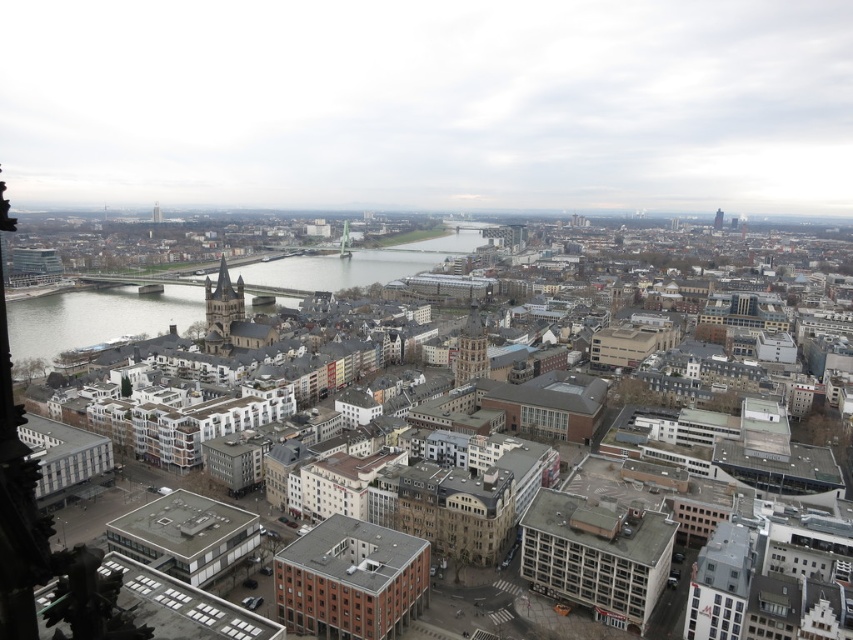
Question: Considering the real-world distances, which object is farthest from the clear glass water at center?

Choices:
 (A) light brown stone tower at center
 (B) brown stone tower at center-left

Answer: (A)

Question: Which of the following is the farthest from the observer?

Choices:
 (A) (161, 214)
 (B) (235, 317)
 (C) (465, 378)

Answer: (A)

Question: In this image, where is clear glass water at center located relative to brown stone tower at center-left?

Choices:
 (A) below
 (B) above

Answer: (B)

Question: Which object appears closest to the camera in this image?

Choices:
 (A) red brick tower at upper right
 (B) smooth gray tower at upper left

Answer: (A)

Question: Is light brown stone tower at center to the right of smooth gray tower at upper left from the viewer's perspective?

Choices:
 (A) yes
 (B) no

Answer: (A)

Question: Observing the image, what is the correct spatial positioning of brown stone tower at center-left in reference to light brown stone tower at center?

Choices:
 (A) right
 (B) left

Answer: (B)